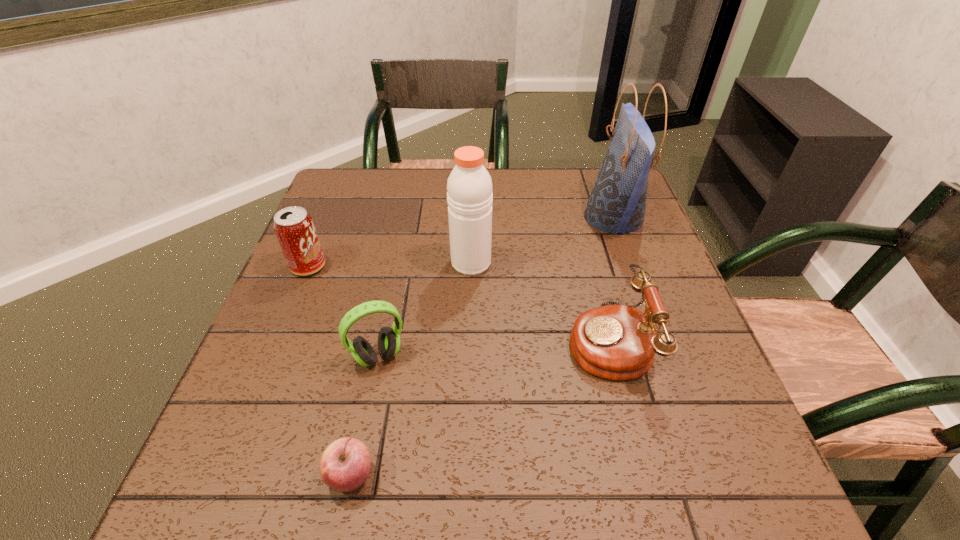
Locate an element on the screen. the tallest object is located at coordinates (617, 203).

Where is `the farthest object`? The width and height of the screenshot is (960, 540). the farthest object is located at coordinates [617, 203].

Where is `the second tallest object`? the second tallest object is located at coordinates (469, 197).

Identify the location of shaker. The height and width of the screenshot is (540, 960). (469, 197).

You are a GUI agent. You are given a task and a screenshot of the screen. Output one action in this format:
    pyautogui.click(x=<x>, y=<y>)
    Task: Click on the leftmost object
    Image resolution: width=960 pixels, height=540 pixels.
    Given the screenshot: What is the action you would take?
    pyautogui.click(x=294, y=228)

Locate an element on the screen. telephone is located at coordinates (617, 342).

Find the location of a particular element. headset is located at coordinates (388, 338).

This screenshot has width=960, height=540. Find the location of `the nearest object`. the nearest object is located at coordinates (345, 465).

This screenshot has height=540, width=960. Find the location of `apple`. apple is located at coordinates (345, 465).

This screenshot has height=540, width=960. Find the location of `vacant position located 0.300m on the left of the shopping bag`. vacant position located 0.300m on the left of the shopping bag is located at coordinates (476, 218).